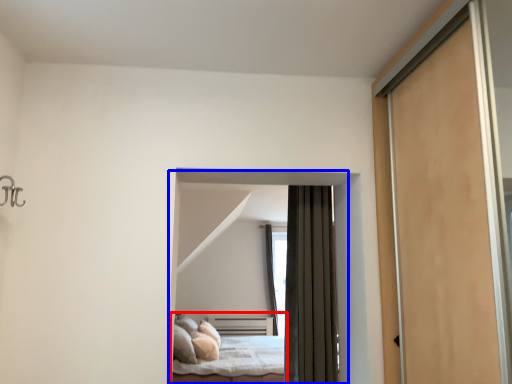
Question: Which object is closer to the camera taking this photo, bed (highlighted by a red box) or bed (highlighted by a blue box)?

Choices:
 (A) bed
 (B) bed

Answer: (B)